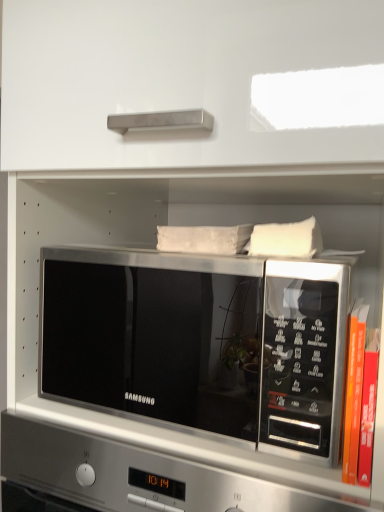
Where is `vacant region to the left of orange hardcover book at right`? Image resolution: width=384 pixels, height=512 pixels. vacant region to the left of orange hardcover book at right is located at coordinates (252, 467).